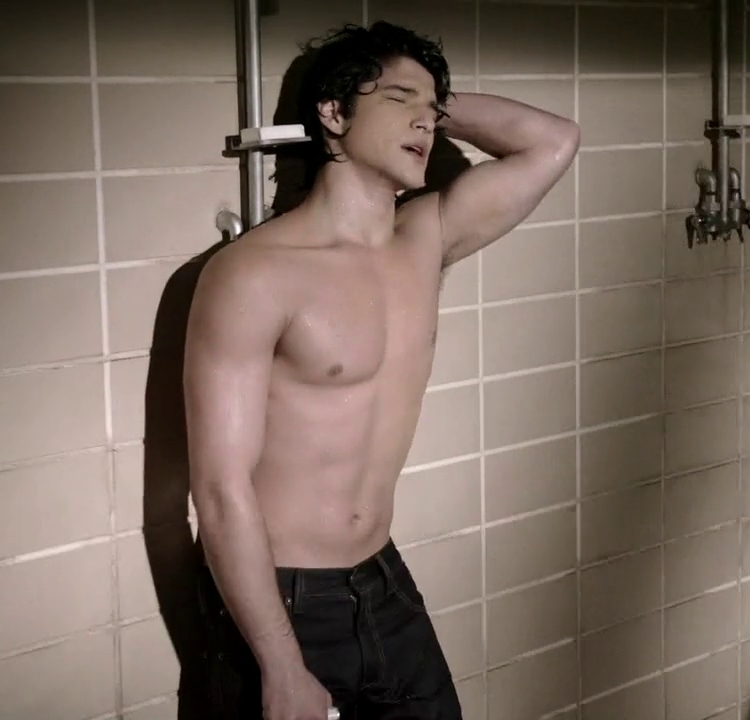
Locate an element on the screen. wall is located at coordinates (522, 472).